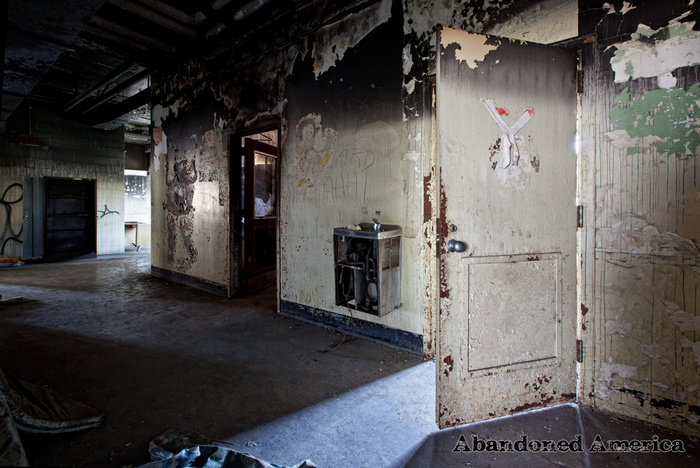
The width and height of the screenshot is (700, 468). I want to click on doorknob, so click(455, 247).